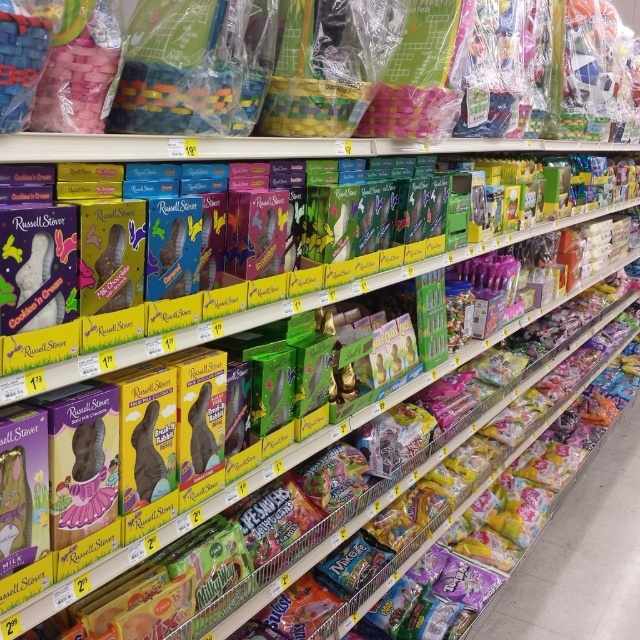
Can you confirm if translucent plastic bags at lower right is positioned to the left of matte plastic easter basket at upper center?

No, translucent plastic bags at lower right is not to the left of matte plastic easter basket at upper center.

Does point (554, 580) come farther from viewer compared to point (595, 3)?

Yes, point (554, 580) is farther from viewer.

Does point (531, 621) come closer to viewer compared to point (140, 131)?

No, (531, 621) is behind (140, 131).

I want to click on translucent plastic bags at lower right, so pos(580,554).